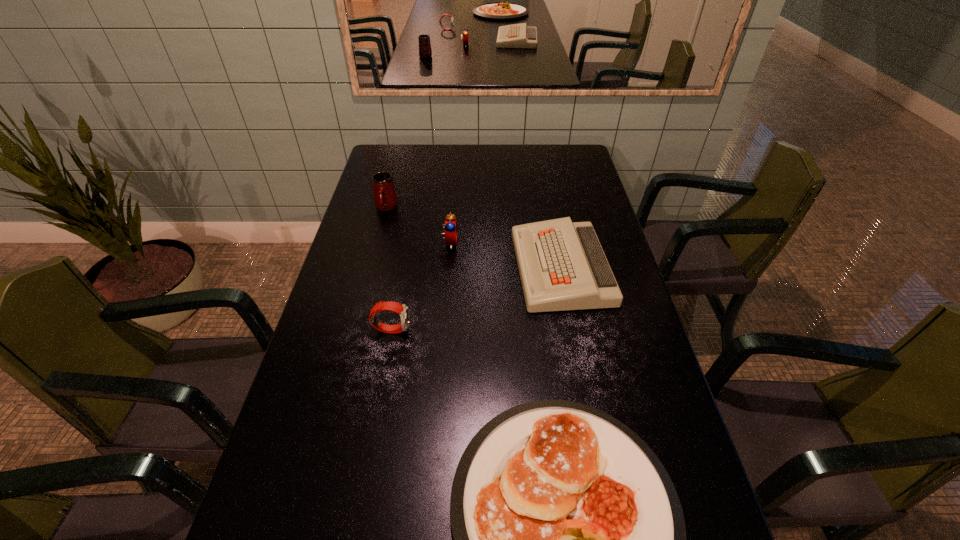
You are a GUI agent. You are given a task and a screenshot of the screen. Output one action in this format:
    pyautogui.click(x=<x>, y=<y>)
    Task: Click on the leftmost object
    Image resolution: width=960 pixels, height=540 pixels.
    Given the screenshot: What is the action you would take?
    pyautogui.click(x=385, y=198)

The width and height of the screenshot is (960, 540). What are the coordinates of `the farthest object` in the screenshot? It's located at (385, 198).

You are a GUI agent. You are given a task and a screenshot of the screen. Output one action in this format:
    pyautogui.click(x=<x>, y=<y>)
    Task: Click on the third object from left to right
    Image resolution: width=960 pixels, height=540 pixels.
    Given the screenshot: What is the action you would take?
    pyautogui.click(x=450, y=224)

The width and height of the screenshot is (960, 540). I want to click on the third shortest object, so click(401, 309).

Identify the location of watch. (401, 309).

Find the location of a particular element. The height and width of the screenshot is (540, 960). the second shortest object is located at coordinates (562, 266).

The width and height of the screenshot is (960, 540). Identify the location of free space located on the side of the mug with the handle. (367, 281).

You are a GUI agent. You are given a task and a screenshot of the screen. Output one action in this format:
    pyautogui.click(x=<x>, y=<y>)
    Task: Click on the vacant area situated on the front-facing side of the alarm clock
    This screenshot has height=540, width=960.
    Given the screenshot: What is the action you would take?
    pyautogui.click(x=565, y=242)

Where is `vacant space located 0.330m on the face of the second object from left to right`? The height and width of the screenshot is (540, 960). vacant space located 0.330m on the face of the second object from left to right is located at coordinates (531, 329).

The height and width of the screenshot is (540, 960). Find the location of `free region located 0.190m on the left of the computer keyboard`. free region located 0.190m on the left of the computer keyboard is located at coordinates (453, 268).